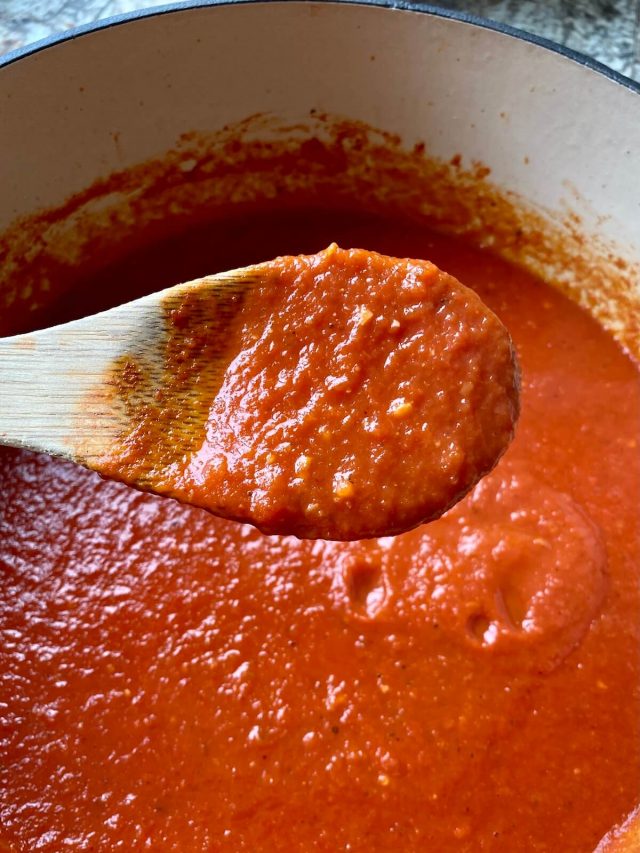
Where is `wooden spoon`? The height and width of the screenshot is (853, 640). wooden spoon is located at coordinates (105, 375).